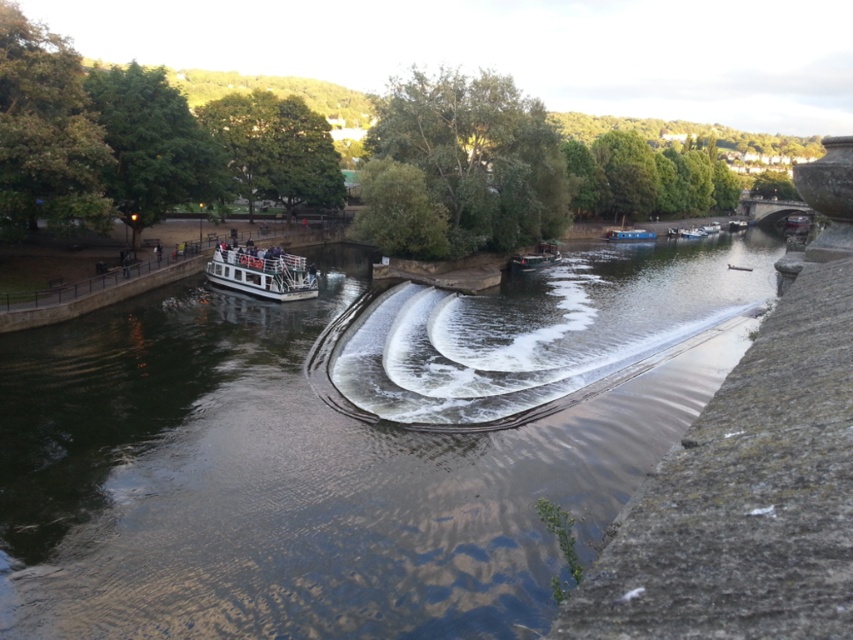
You are a photographer planning to take a photo of the white glossy boat at center and the wooden boat at center from the riverside. Which boat will appear taller in your photo?

The white glossy boat at center will appear taller in the photo because it is taller than the wooden boat at center according to the description.

You are standing at the riverside and want to take a photo of the point at coordinate (283, 275). The camera you have can focus on objects up to 200 feet away. Will the point be in focus?

The point at coordinate (283, 275) is 153.25 feet from the camera, which is within the camera focus range of 200 feet. Therefore, the point will be in focus.